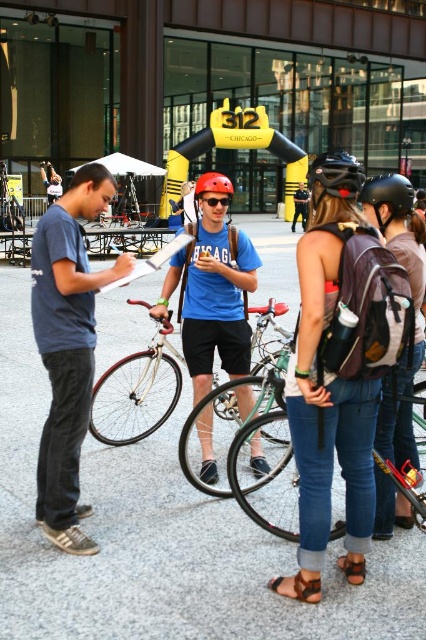
Is matte blue t-shirt at center shorter than shiny red helmet at center?

Indeed, matte blue t-shirt at center has a lesser height compared to shiny red helmet at center.

Does matte blue t-shirt at center appear on the left side of shiny red helmet at center?

Correct, you'll find matte blue t-shirt at center to the left of shiny red helmet at center.

Looking at this image, measure the distance between point (238, 273) and camera.

Point (238, 273) and camera are 4.63 meters apart.

You are a GUI agent. You are given a task and a screenshot of the screen. Output one action in this format:
    pyautogui.click(x=<x>, y=<y>)
    Task: Click on the matte blue t-shirt at center
    This screenshot has height=640, width=426.
    Given the screenshot: What is the action you would take?
    pyautogui.click(x=213, y=294)

In the scene shown: Who is higher up, shiny red helmet at center or matte blue shirt at center?

matte blue shirt at center

Which is in front, point (221, 179) or point (291, 220)?

Point (221, 179) is in front.

Where is `shiny red helmet at center`? The height and width of the screenshot is (640, 426). shiny red helmet at center is located at coordinates coord(213,184).

Can you confirm if matte black backpack at center is wider than white matte bicycle at center?

In fact, matte black backpack at center might be narrower than white matte bicycle at center.

Does matte black backpack at center appear under white matte bicycle at center?

Actually, matte black backpack at center is above white matte bicycle at center.

This screenshot has width=426, height=640. What are the coordinates of `matte black backpack at center` in the screenshot? It's located at (412, 301).

The width and height of the screenshot is (426, 640). Identify the location of matte black backpack at center. (412, 301).